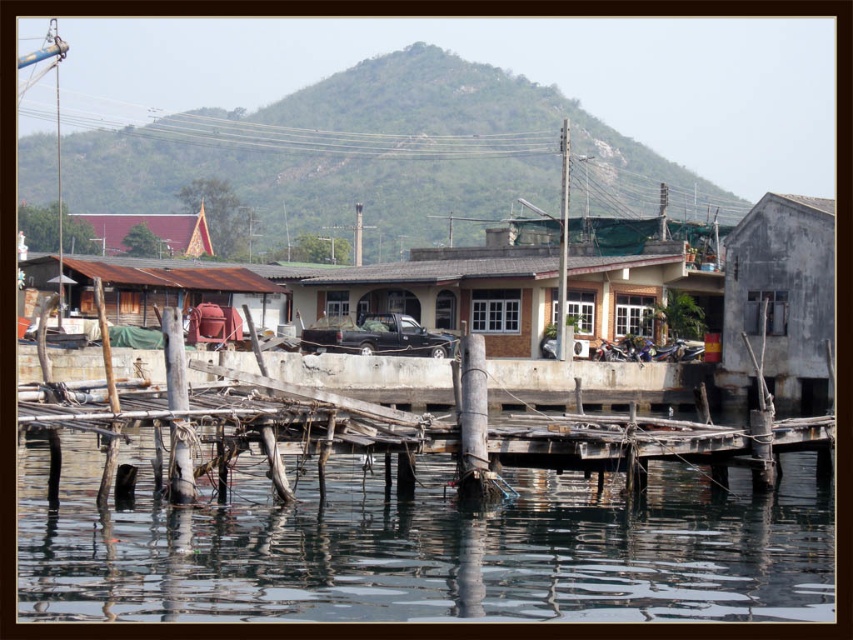
Question: Which object is farther from the camera taking this photo?

Choices:
 (A) weathered wood dock at center
 (B) transparent water at lower center

Answer: (A)

Question: Is gray concrete hut at right bigger than matte red tent at upper center?

Choices:
 (A) yes
 (B) no

Answer: (B)

Question: Can you confirm if transparent water at lower center is smaller than rusty wood hut at left?

Choices:
 (A) no
 (B) yes

Answer: (A)

Question: Does gray concrete hut at right have a smaller size compared to rusty wood hut at left?

Choices:
 (A) yes
 (B) no

Answer: (A)

Question: Among these objects, which one is nearest to the camera?

Choices:
 (A) rusty wood hut at left
 (B) gray concrete hut at right
 (C) brown textured hut at center

Answer: (A)

Question: Which object is positioned farthest from the weathered wood dock at center?

Choices:
 (A) matte red tent at upper center
 (B) gray concrete hut at right
 (C) brown textured hut at center
 (D) rusty wood hut at left

Answer: (A)